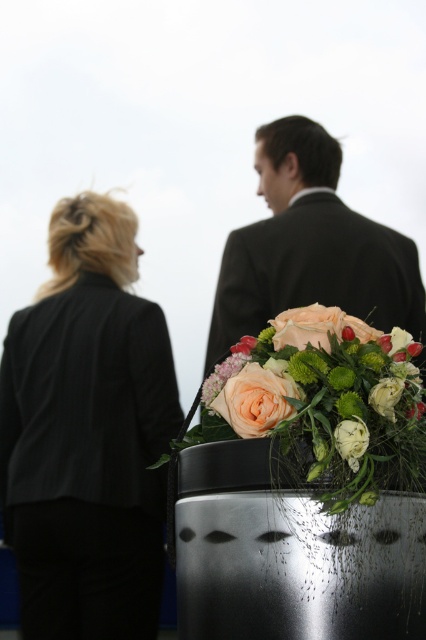
Does matte peach rose at center have a lesser height compared to white matte flower at center?

No, matte peach rose at center is not shorter than white matte flower at center.

Between point (336, 330) and point (348, 449), which one is positioned in front?

Point (348, 449) is in front.

Where is `matte peach rose at center`? The image size is (426, 640). matte peach rose at center is located at coordinates (316, 326).

The height and width of the screenshot is (640, 426). What do you see at coordinates (86, 433) in the screenshot?
I see `black fabric jacket at left` at bounding box center [86, 433].

Between black fabric jacket at left and matte black suit at center, which one appears on the right side from the viewer's perspective?

matte black suit at center

Who is more distant from viewer, (103, 467) or (218, 289)?

The point (218, 289) is more distant.

You are a GUI agent. You are given a task and a screenshot of the screen. Output one action in this format:
    pyautogui.click(x=<x>, y=<y>)
    Task: Click on the black fabric jacket at left
    The height and width of the screenshot is (640, 426).
    Given the screenshot: What is the action you would take?
    pyautogui.click(x=86, y=433)

Does matte black suit at center appear on the right side of soft peach rose at center?

Correct, you'll find matte black suit at center to the right of soft peach rose at center.

Can you confirm if matte black suit at center is taller than soft peach rose at center?

Yes, matte black suit at center is taller than soft peach rose at center.

Is point (235, 332) less distant than point (250, 403)?

No, it is not.

I want to click on matte black suit at center, so click(x=310, y=246).